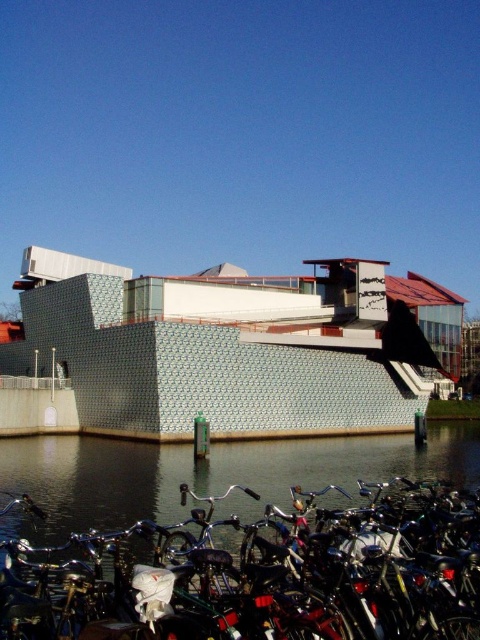
You are standing in front of the modern building by the canal and see the shiny metallic bicycle at lower left and the dark water at lower left. Which object is closer to the left edge of the image?

The shiny metallic bicycle at lower left is positioned on the left side of dark water at lower left, so it is closer to the left edge of the image.

You are standing at the base of the modern architectural structure and looking up at its roof. There are two points marked on the roof surface, point 1 at coordinates point (248, 566) and point 2 at point (472, 456). Which point is closer to your current position?

Point (248, 566) is closer to the viewer than point (472, 456).

You are a photographer planning to capture the modern architectural structure in the image. You want to ensure that both the shiny metallic bicycle at lower left and the dark water at lower left are visible in your shot. Based on their widths, which object should you position closer to the edge of the frame to include both?

The shiny metallic bicycle at lower left has a lesser width compared to the dark water at lower left. To include both in the frame, position the narrower shiny metallic bicycle at lower left closer to the edge since it takes up less space, allowing the wider dark water at lower left to occupy more of the frame while still fitting both elements.